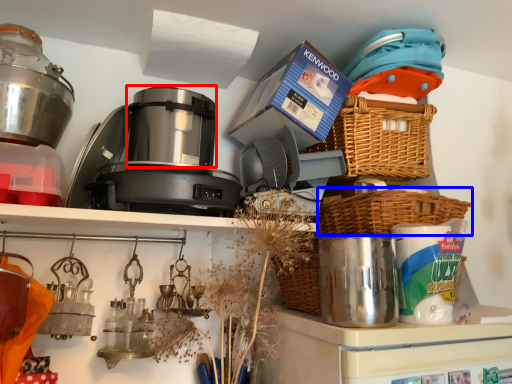
Question: Which object is further to the camera taking this photo, appliance (highlighted by a red box) or basket (highlighted by a blue box)?

Choices:
 (A) appliance
 (B) basket

Answer: (A)